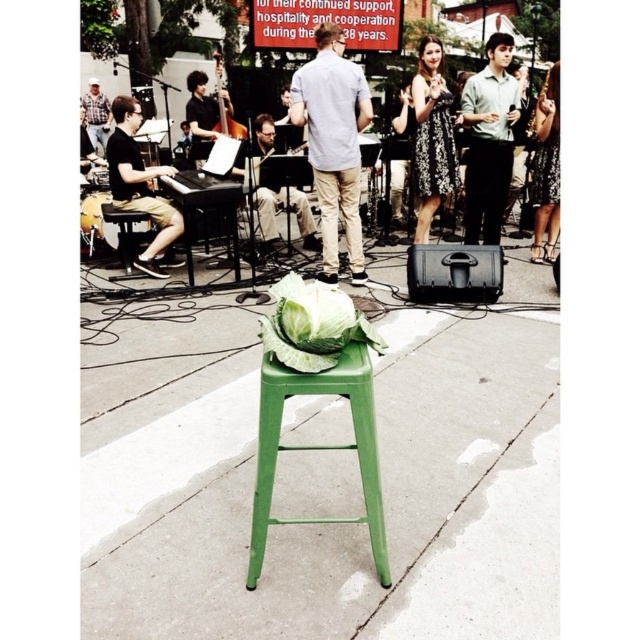
Question: Can you confirm if matte black shirt at left is positioned below plaid shirt at left?

Choices:
 (A) no
 (B) yes

Answer: (B)

Question: Which point appears closest to the camera in this image?

Choices:
 (A) (113, 134)
 (B) (356, 369)
 (C) (534, 188)
 (D) (294, 97)

Answer: (B)

Question: Based on their relative distances, which object is farther from the matte black shirt at center?

Choices:
 (A) green metal stool at center
 (B) brushed metal cello at center

Answer: (A)

Question: Which point is farther to the camera?

Choices:
 (A) (104, 129)
 (B) (456, 163)
 (C) (225, 104)
 (D) (308, 317)

Answer: (A)

Question: Is black floral dress at center thinner than satin gold dress at upper right?

Choices:
 (A) yes
 (B) no

Answer: (B)

Question: Can you confirm if green leafy vegetable at center is positioned to the right of satin gold dress at upper right?

Choices:
 (A) no
 (B) yes

Answer: (A)